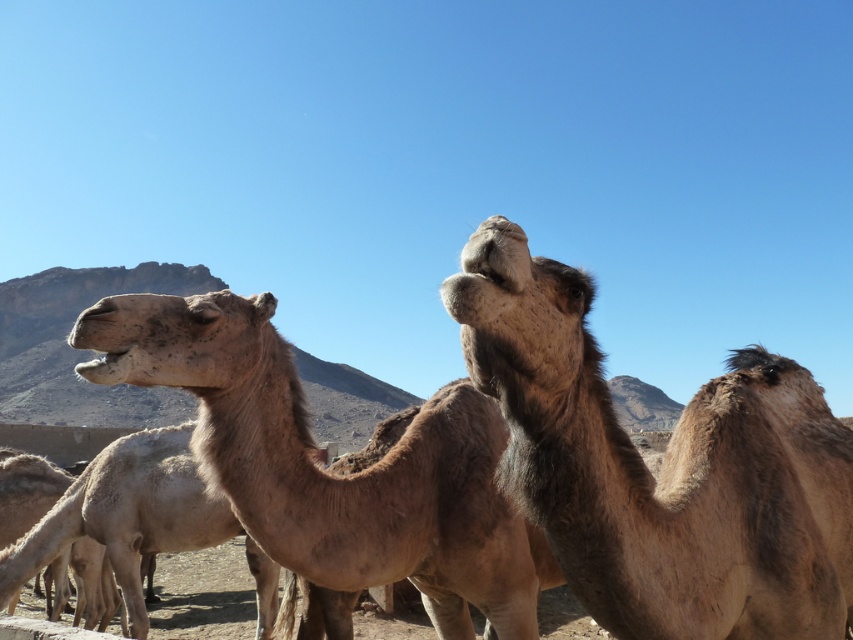
Question: Is brown fuzzy camel at upper right bigger than fuzzy brown camel at center?

Choices:
 (A) yes
 (B) no

Answer: (B)

Question: Considering the real-world distances, which object is closest to the brown fuzzy camel at center?

Choices:
 (A) brown fuzzy camel at upper right
 (B) fuzzy brown camel at center
 (C) brown textured camel at center

Answer: (A)

Question: Which point is farther to the camera?

Choices:
 (A) fuzzy brown camel at center
 (B) brown fuzzy camel at upper right
 (C) brown fuzzy camel at center

Answer: (A)

Question: Which of the following is the closest to the observer?

Choices:
 (A) brown textured camel at center
 (B) brown fuzzy camel at center
 (C) fuzzy brown camel at center
 (D) brown fuzzy camel at upper right

Answer: (D)

Question: Does brown fuzzy camel at upper right appear over brown textured camel at center?

Choices:
 (A) yes
 (B) no

Answer: (A)

Question: Can you confirm if brown fuzzy camel at upper right is wider than brown textured camel at center?

Choices:
 (A) yes
 (B) no

Answer: (A)